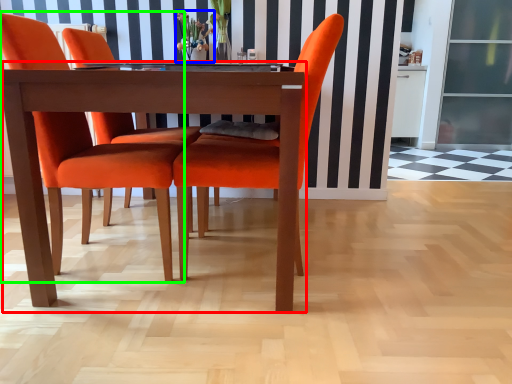
Question: Considering the real-world distances, which object is farthest from kitchen & dining room table (highlighted by a red box)? floral arrangement (highlighted by a blue box) or chair (highlighted by a green box)?

Choices:
 (A) floral arrangement
 (B) chair

Answer: (A)